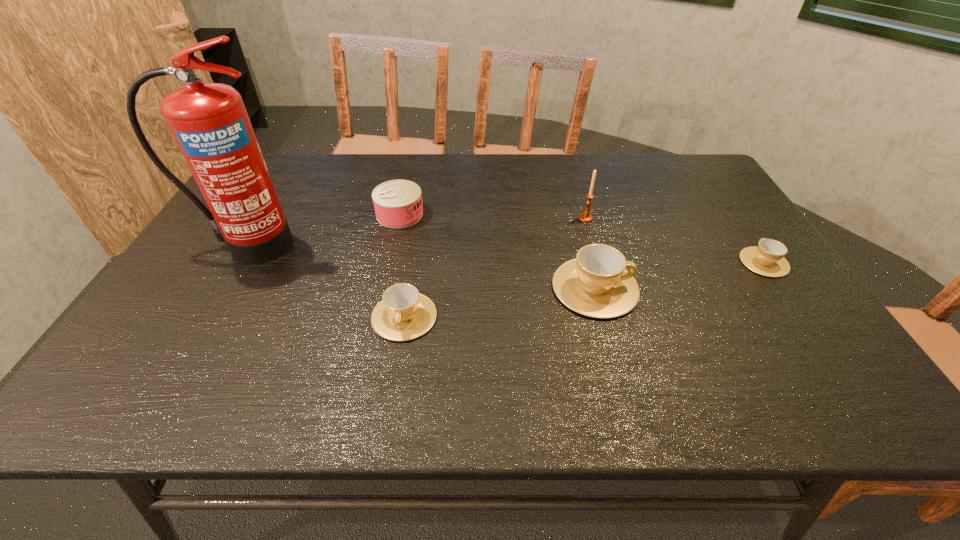
In the image, there is a desktop. In order to click on free space at the left edge in this screenshot , I will do `click(199, 330)`.

Locate an element on the screen. vacant space at the right edge of the desktop is located at coordinates [x=752, y=234].

The width and height of the screenshot is (960, 540). I want to click on free region at the far left corner, so click(283, 185).

The height and width of the screenshot is (540, 960). I want to click on blank space at the near left corner of the desktop, so click(162, 348).

This screenshot has height=540, width=960. What are the coordinates of `vacant space in between the rightmost object and the second tallest object` in the screenshot? It's located at (675, 240).

I want to click on vacant area between the can and the second shortest cup, so click(402, 266).

In order to click on vacant space that is in between the fourth shortest object and the can in this screenshot , I will do `click(497, 251)`.

Locate an element on the screen. unoccupied area between the can and the third tallest object is located at coordinates (x=497, y=251).

The width and height of the screenshot is (960, 540). I want to click on empty location between the second tallest object and the rightmost cup, so click(x=675, y=240).

What are the coordinates of `free space between the can and the tallest object` in the screenshot? It's located at (324, 230).